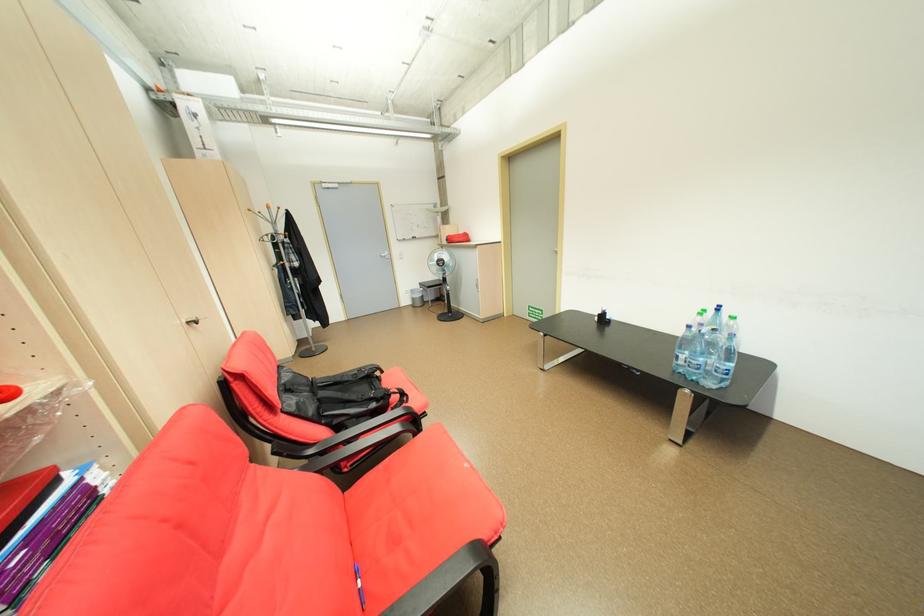
Find the location of a particular element. This screenshot has width=924, height=616. red chair sitting surface is located at coordinates (410, 508).